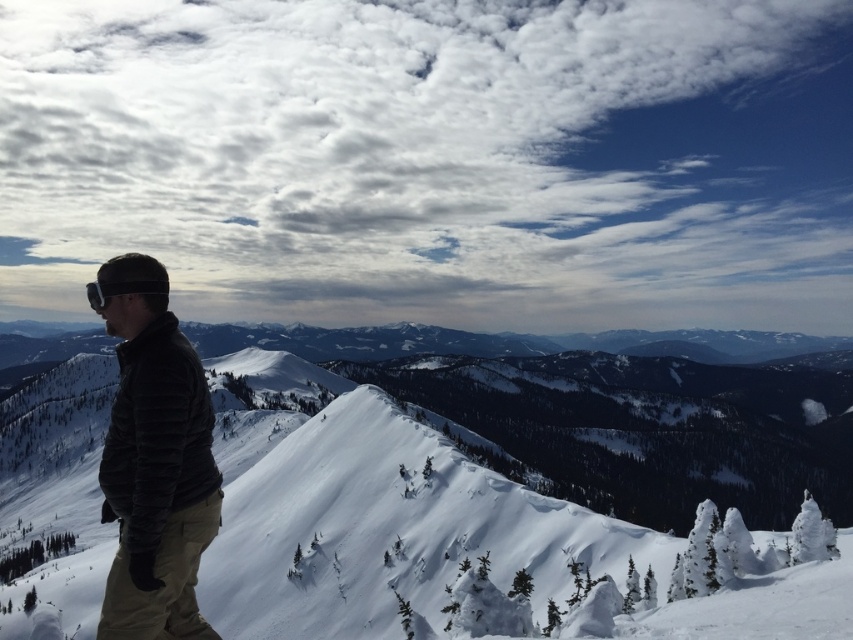
Between white fluffy snow at center and dark gray quilted jacket at left, which one appears on the left side from the viewer's perspective?

dark gray quilted jacket at left is more to the left.

Does point (32, 388) lie behind point (167, 380)?

Yes, it is behind point (167, 380).

Is point (784, 394) less distant than point (172, 317)?

No, it is not.

Where is `white fluffy snow at center`? This screenshot has width=853, height=640. white fluffy snow at center is located at coordinates (491, 474).

Based on the photo, can you confirm if white fluffy snow at center is positioned to the right of matte black goggles at left?

Yes, white fluffy snow at center is to the right of matte black goggles at left.

Who is positioned more to the left, white fluffy snow at center or matte black goggles at left?

Positioned to the left is matte black goggles at left.

Is point (786, 624) in front of point (105, 291)?

No, (786, 624) is further to viewer.

You are a GUI agent. You are given a task and a screenshot of the screen. Output one action in this format:
    pyautogui.click(x=<x>, y=<y>)
    Task: Click on the white fluffy snow at center
    
    Given the screenshot: What is the action you would take?
    pyautogui.click(x=491, y=474)

Between point (202, 413) and point (112, 292), which one is positioned behind?

The point (202, 413) is more distant.

Identify the location of dark gray quilted jacket at left. The height and width of the screenshot is (640, 853). (155, 476).